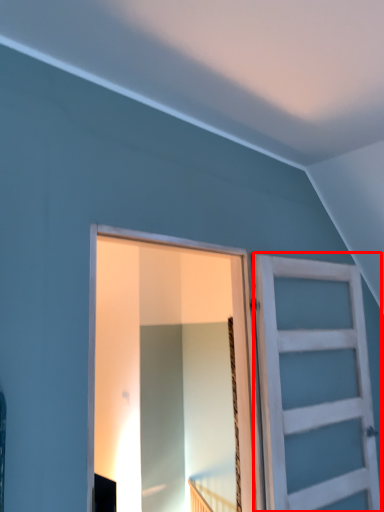
Question: From the image's perspective, where is barn door (annotated by the red box) located relative to barn door?

Choices:
 (A) above
 (B) below

Answer: (B)